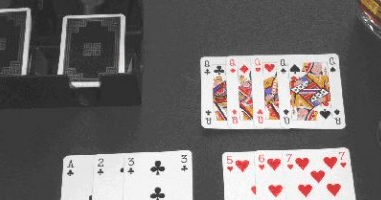
Locate an element on the screen. empty space on table is located at coordinates (245, 22).